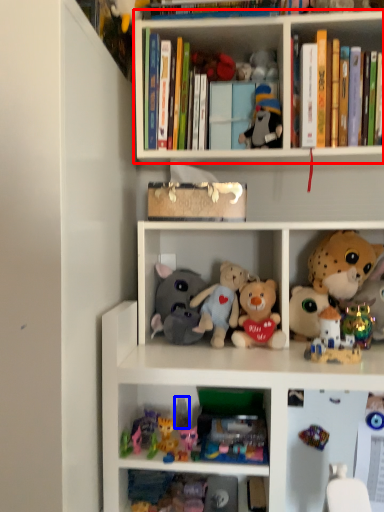
Question: Which of the following is the farthest to the observer, shelf (highlighted by a red box) or toy (highlighted by a blue box)?

Choices:
 (A) shelf
 (B) toy

Answer: (B)